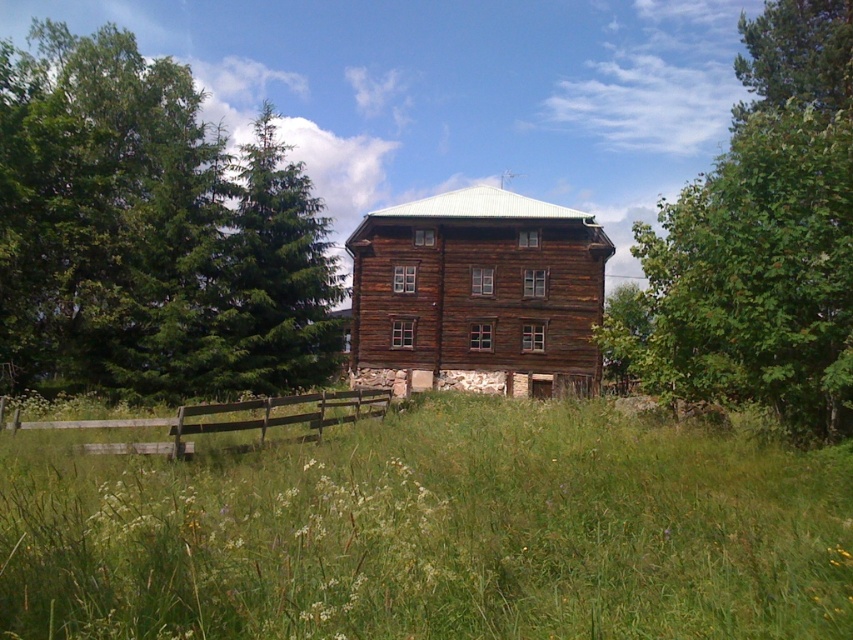
The width and height of the screenshot is (853, 640). I want to click on green grassy field at center, so click(x=434, y=532).

Is point (113, 572) farther from camera compared to point (221, 317)?

No, it is not.

Who is more distant from viewer, (x=267, y=529) or (x=308, y=234)?

Positioned behind is point (x=308, y=234).

This screenshot has width=853, height=640. Identify the location of green grassy field at center. (434, 532).

Is point (805, 554) positioned after point (173, 282)?

No, it is in front of (173, 282).

How much distance is there between green grassy field at center and green textured tree at upper left?

green grassy field at center and green textured tree at upper left are 23.77 meters apart from each other.

Is point (804, 586) positioned before point (96, 77)?

Yes, it is.

Find the location of `green grassy field at center`. green grassy field at center is located at coordinates (434, 532).

Looking at this image, is green textured tree at upper left to the left of green textured pine tree at upper left from the viewer's perspective?

Incorrect, green textured tree at upper left is not on the left side of green textured pine tree at upper left.

Does point (294, 246) come behind point (335, 356)?

That is False.

Who is more distant from viewer, (115,308) or (236,358)?

Point (236,358)

Where is `green textured tree at upper left`? green textured tree at upper left is located at coordinates (149, 232).